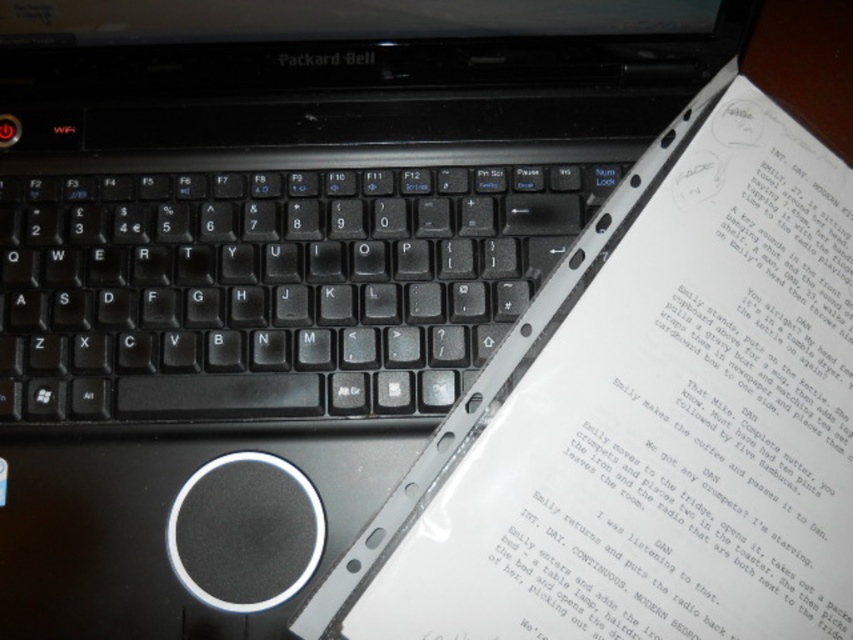
You are trying to place a new sticker on your laptop keyboard. You have a sticker that is exactly the same size as the black plastic keyboard at center. Where should you place the sticker so that it doesn not overlap with the white paper at upper right?

The white paper at upper right is positioned on the right side of the black plastic keyboard at center. To avoid overlapping, place the sticker on the left side of the black plastic keyboard at center.

You are trying to access the keyboard of the Packard Bell laptop but notice the white paper at upper right and the black plastic keyboard at center. Which object is blocking your access to the keyboard?

The white paper at upper right is positioned under the black plastic keyboard at center, so the black plastic keyboard at center is blocking access to the keyboard.